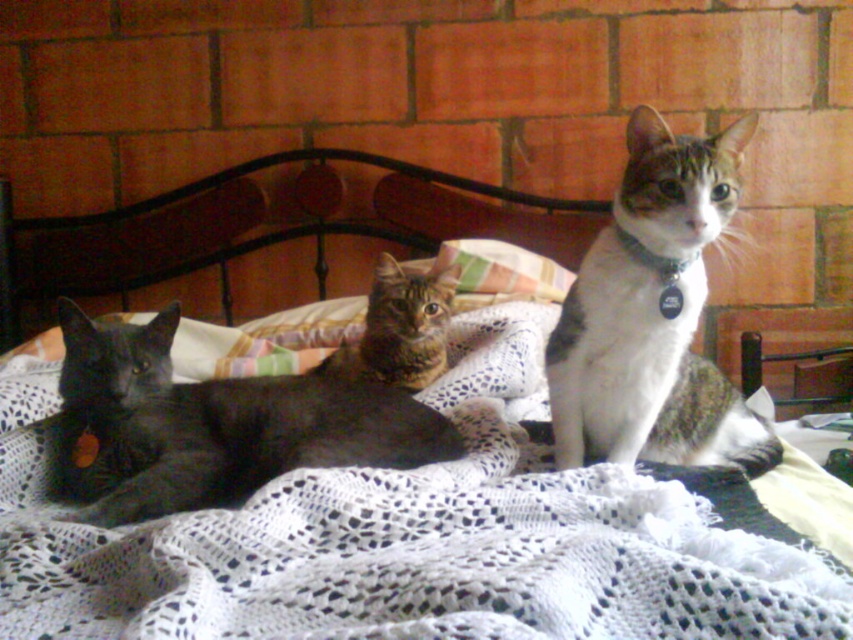
What is located at the coordinates point (215, 424) in the image?

The shiny black cat at left is located at point (215, 424).

You are a photographer taking a picture of the shiny black cat at left and the tabby fur cat at center. Which cat will appear larger in the photo?

The shiny black cat at left will appear larger in the photo because it is closer to the viewer than the tabby fur cat at center.

Based on the photo, you are trying to place a new small toy between the shiny black cat at left and the striped fabric pillow at center on the bed. Based on their sizes, do you think there will be enough space for the toy?

The shiny black cat at left is larger in width than the striped fabric pillow at center, so there might be sufficient space between them to place the toy.